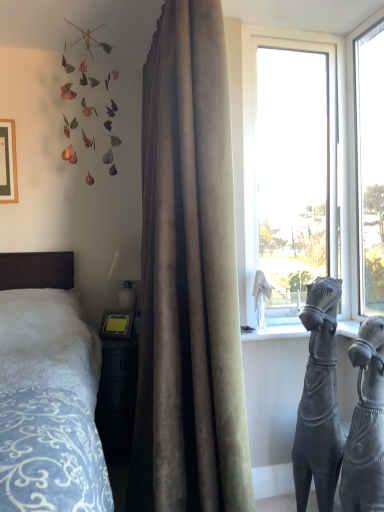
Question: Considering the relative positions of satin curtain at center and transparent glass window at upper right, which is the 1th window from right to left, in the image provided, is satin curtain at center behind transparent glass window at upper right, which is the 1th window from right to left,?

Choices:
 (A) yes
 (B) no

Answer: (B)

Question: From the image's perspective, is satin curtain at center above transparent glass window at upper right, which is the 1th window from right to left?

Choices:
 (A) yes
 (B) no

Answer: (B)

Question: Is satin curtain at center thinner than transparent glass window at upper right, the 2th window from the left?

Choices:
 (A) yes
 (B) no

Answer: (B)

Question: Is satin curtain at center to the right of transparent glass window at upper right, the 2th window from the left, from the viewer's perspective?

Choices:
 (A) no
 (B) yes

Answer: (A)

Question: Is satin curtain at center oriented towards transparent glass window at upper right, the 2th window from the left?

Choices:
 (A) no
 (B) yes

Answer: (B)

Question: From a real-world perspective, is satin curtain at center over transparent glass window at upper right, the 2th window from the left?

Choices:
 (A) yes
 (B) no

Answer: (B)

Question: Is bronze statue at right at the right side of transparent glass window at center, positioned as the second window in right-to-left order?

Choices:
 (A) no
 (B) yes

Answer: (B)

Question: Is bronze statue at right positioned in front of transparent glass window at center, which appears as the 1th window when viewed from the left?

Choices:
 (A) no
 (B) yes

Answer: (B)

Question: Would you say bronze statue at right is outside transparent glass window at center, which appears as the 1th window when viewed from the left?

Choices:
 (A) no
 (B) yes

Answer: (B)

Question: Is bronze statue at right shorter than transparent glass window at center, which appears as the 1th window when viewed from the left?

Choices:
 (A) yes
 (B) no

Answer: (A)

Question: Does bronze statue at right have a lesser width compared to transparent glass window at center, positioned as the second window in right-to-left order?

Choices:
 (A) yes
 (B) no

Answer: (B)

Question: From the image's perspective, would you say bronze statue at right is positioned over transparent glass window at center, positioned as the second window in right-to-left order?

Choices:
 (A) no
 (B) yes

Answer: (A)

Question: Can you confirm if matte black picture frame at upper left is taller than metallic leaf mobile at upper left?

Choices:
 (A) yes
 (B) no

Answer: (B)